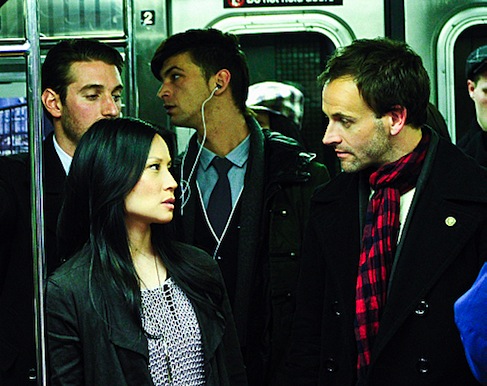
Identify the location of window. (20, 129).